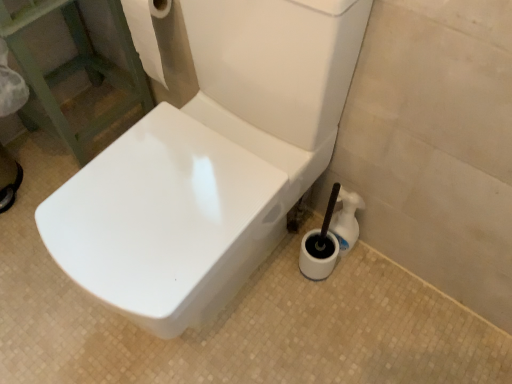
This screenshot has height=384, width=512. I want to click on free space to the right of white glossy toilet at center, so click(x=361, y=314).